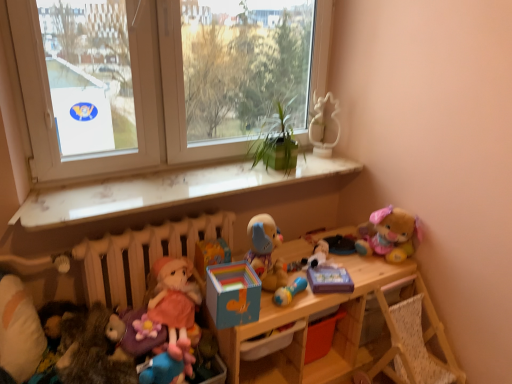
Find the location of a particular element. free space above white marble window sill at upper center (from a real-world perspective) is located at coordinates (145, 187).